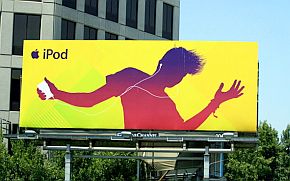
Where is `windows`? The height and width of the screenshot is (181, 290). windows is located at coordinates (18, 27), (71, 4), (65, 29), (90, 31), (90, 9), (109, 5), (132, 9), (146, 14), (164, 23).